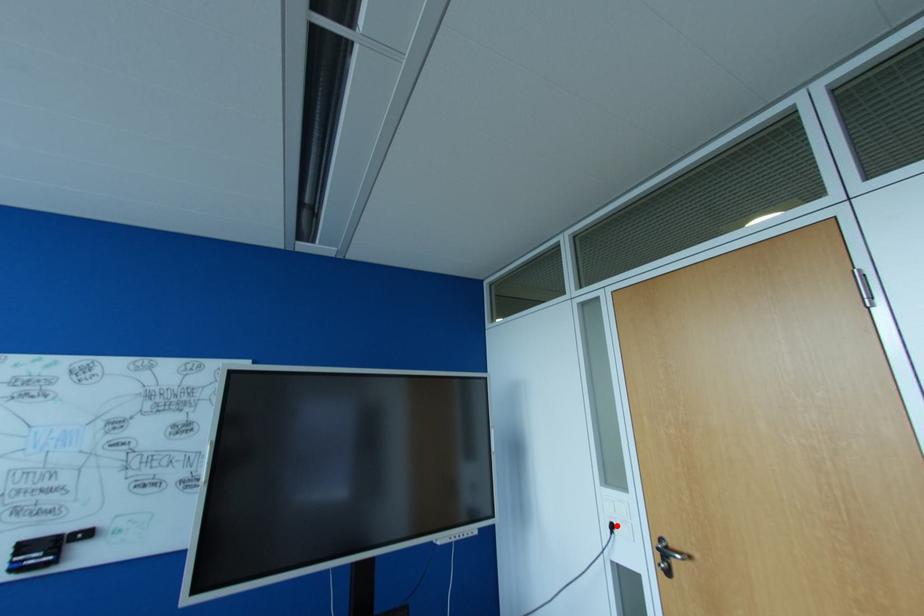
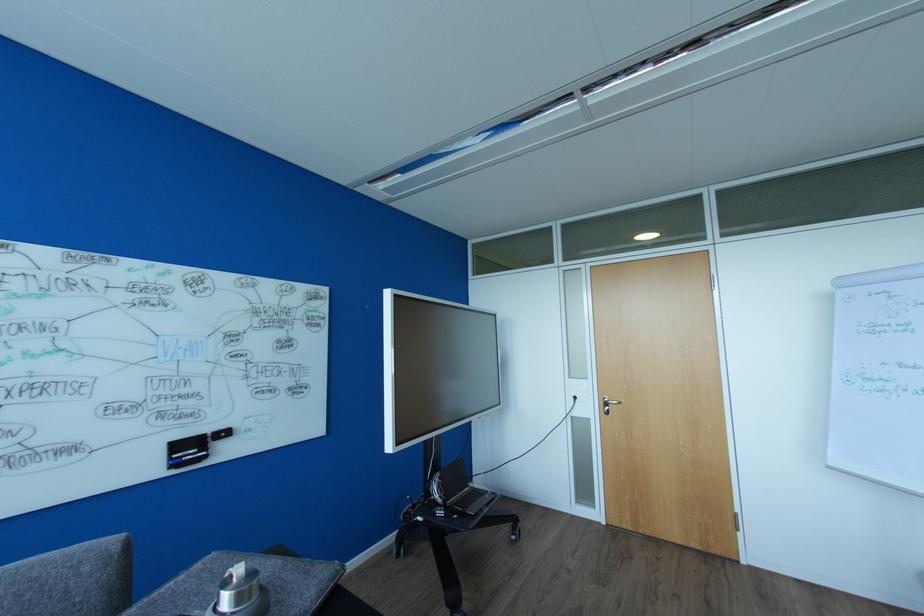
Question: I am providing you with two images of the same scene from different viewpoints. Image1 has a red point marked. In image2, the corresponding 3D location appears at what relative position? Reply with the corresponding letter.

Choices:
 (A) Closer
 (B) Farther

Answer: (B)